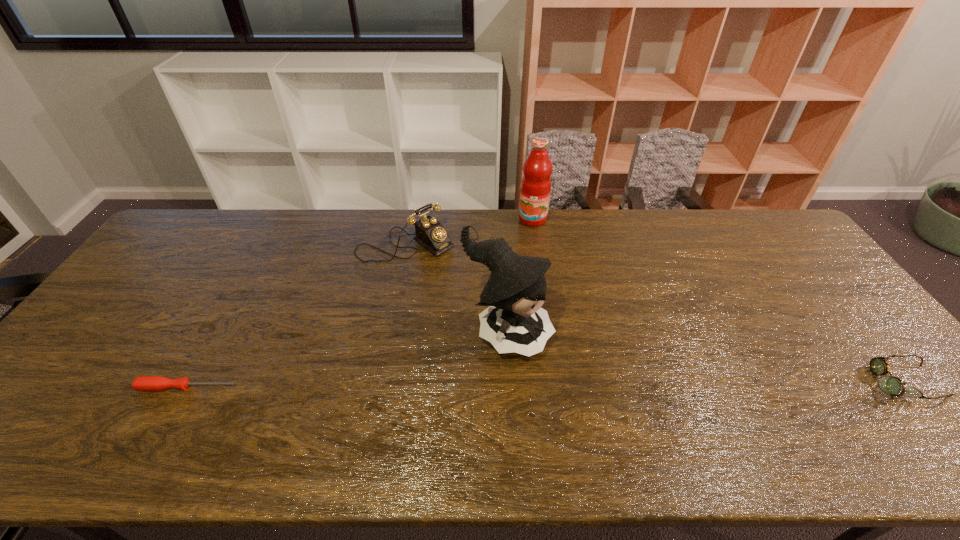
Where is `vacant space located at the face of the doll`? This screenshot has width=960, height=540. vacant space located at the face of the doll is located at coordinates (591, 380).

The height and width of the screenshot is (540, 960). In order to click on vacant space situated 0.160m at the face of the doll in this screenshot , I will do `click(602, 387)`.

Locate an element on the screen. This screenshot has width=960, height=540. vacant space located 0.190m on the front label of the fruit juice is located at coordinates (517, 261).

Image resolution: width=960 pixels, height=540 pixels. I want to click on vacant region located 0.140m on the front label of the fruit juice, so click(x=521, y=252).

At what (x,y) coordinates should I click in order to perform the action: click on vacant space located 0.210m on the front label of the fruit juice. Please return your answer as a coordinate pair (x, y). Looking at the image, I should click on (516, 266).

This screenshot has height=540, width=960. Find the location of `vacant space located 0.290m on the dial of the second farthest object`. vacant space located 0.290m on the dial of the second farthest object is located at coordinates (501, 306).

Where is `vacant space located on the dial of the second farthest object`? This screenshot has height=540, width=960. vacant space located on the dial of the second farthest object is located at coordinates (487, 295).

Find the location of a particular element. free space located on the dial of the second farthest object is located at coordinates (451, 269).

Identify the location of fruit juice that is at the far edge. The height and width of the screenshot is (540, 960). (536, 184).

Find the location of a particular element. The width and height of the screenshot is (960, 540). telephone that is at the far edge is located at coordinates (430, 233).